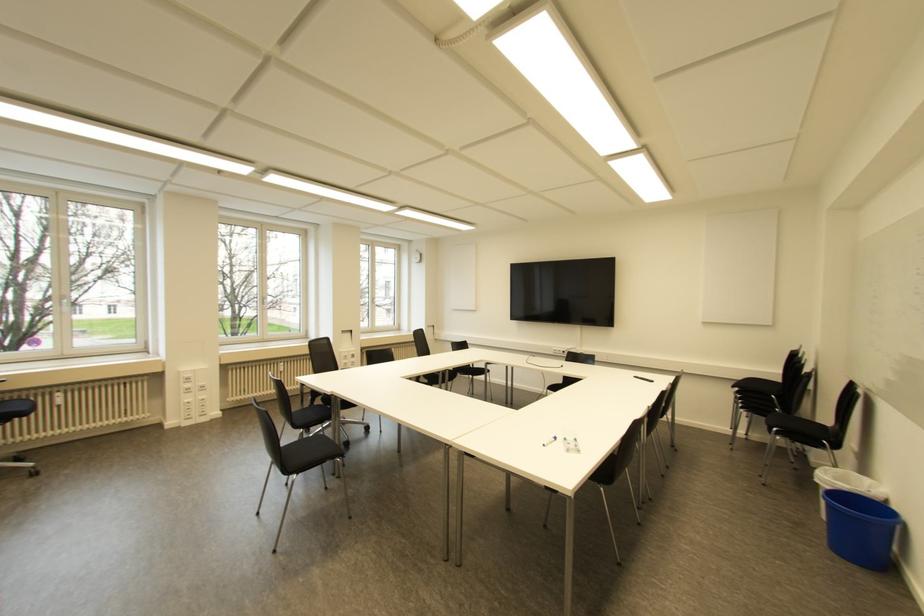
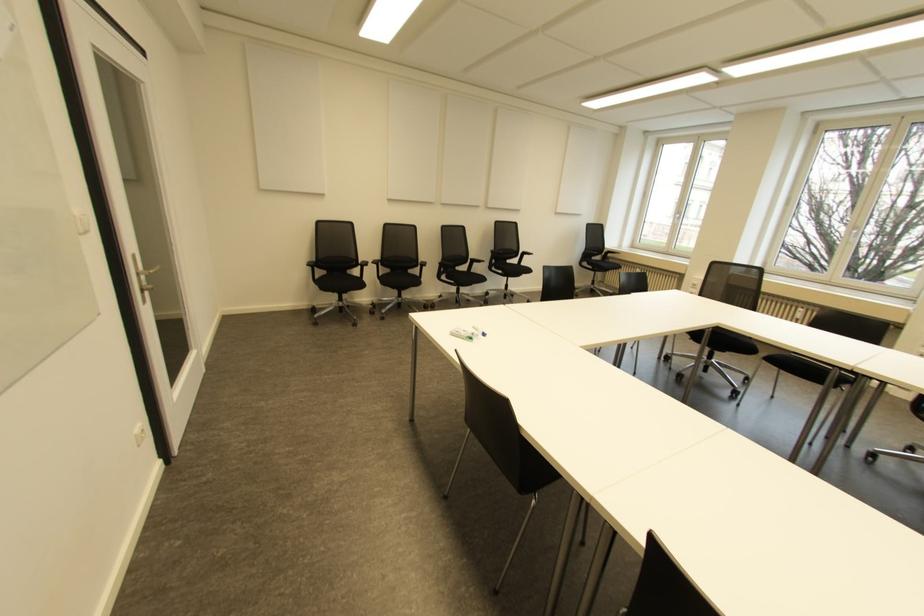
Where in the second image is the point corresponding to pixel 576 439 from the first image?

(470, 338)